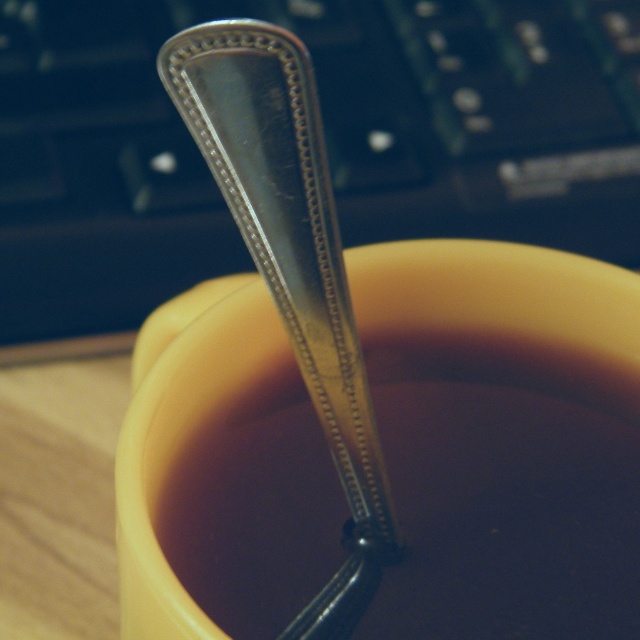
Between shiny metallic spoon at center and polished silver spoon at center, which one is positioned lower?

shiny metallic spoon at center

Who is higher up, shiny metallic spoon at center or polished silver spoon at center?

polished silver spoon at center

Identify the location of shiny metallic spoon at center. The height and width of the screenshot is (640, 640). (506, 497).

Who is more distant from viewer, (60,262) or (371,620)?

Point (60,262)

Can you confirm if black plastic keyboard at upper center is positioned to the right of shiny metallic spoon at center?

No, black plastic keyboard at upper center is not to the right of shiny metallic spoon at center.

Which is in front, point (408, 154) or point (385, 401)?

Positioned in front is point (385, 401).

At what (x,y) coordinates should I click in order to perform the action: click on black plastic keyboard at upper center. Please return your answer as a coordinate pair (x, y). Looking at the image, I should click on (324, 134).

Looking at this image, between black plastic keyboard at upper center and polished silver spoon at center, which one appears on the right side from the viewer's perspective?

black plastic keyboard at upper center

Does point (88, 269) come closer to viewer compared to point (198, 36)?

That is False.

From the picture: Who is more distant from viewer, (84, 196) or (256, 228)?

The point (84, 196) is behind.

In order to click on black plastic keyboard at upper center in this screenshot , I will do `click(324, 134)`.